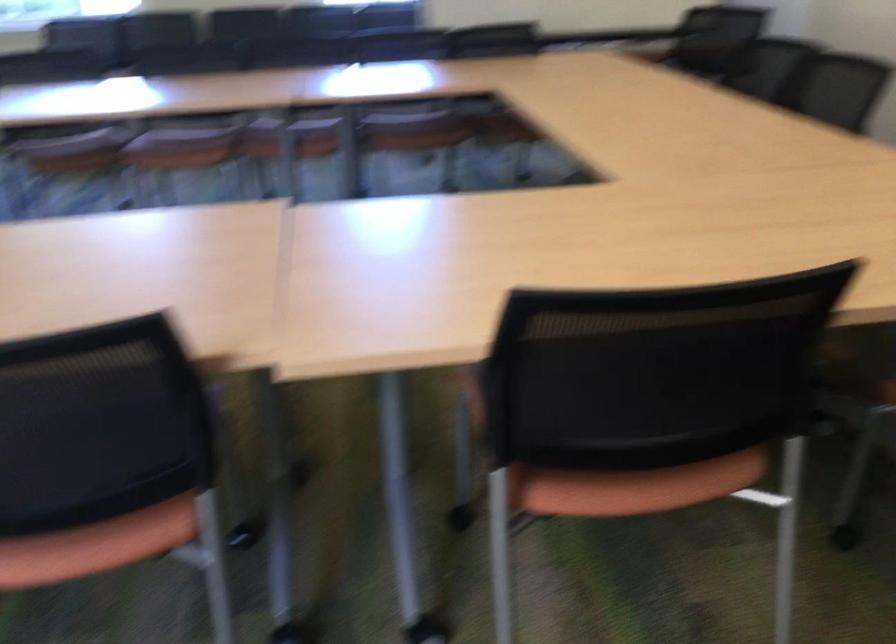
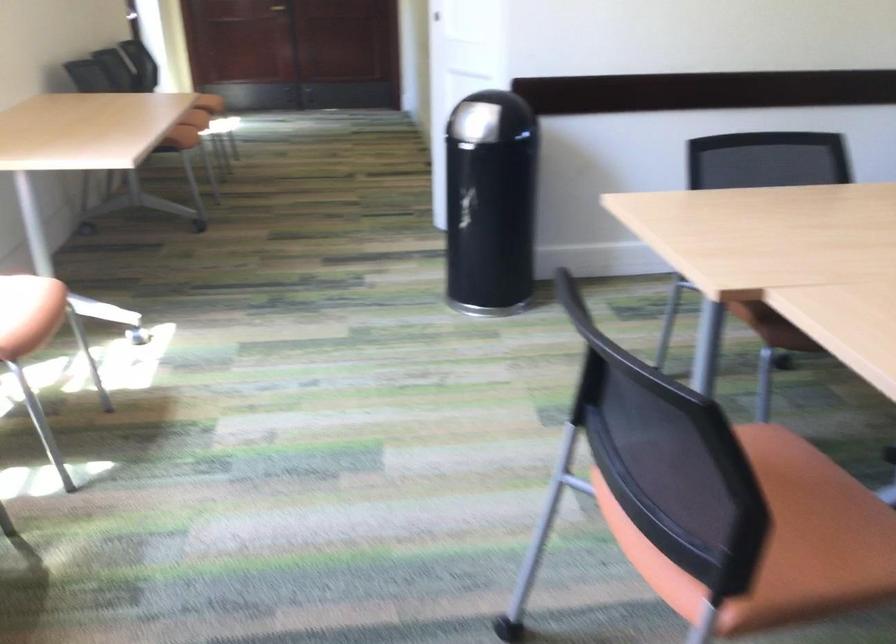
The first image is from the beginning of the video and the second image is from the end. How did the camera likely rotate when shooting the video?

The camera's rotation is toward left-down.